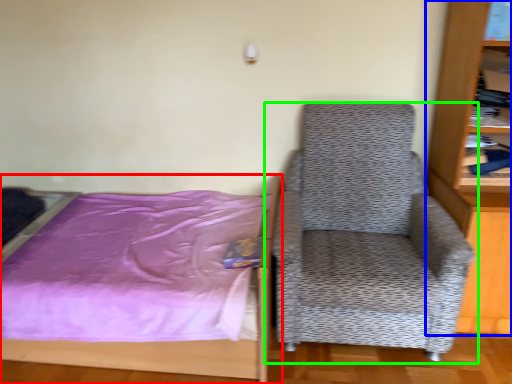
Question: Which is nearer to the bed (highlighted by a red box)? bookcase (highlighted by a blue box) or chair (highlighted by a green box).

Choices:
 (A) bookcase
 (B) chair

Answer: (B)